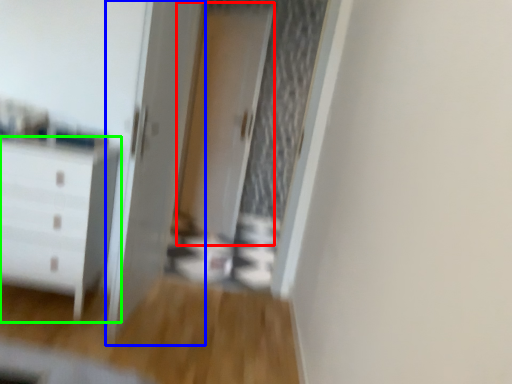
Question: Based on their relative distances, which object is nearer to screen door (highlighted by a red box)? Choose from door (highlighted by a blue box) and chest of drawers (highlighted by a green box).

Choices:
 (A) door
 (B) chest of drawers

Answer: (A)